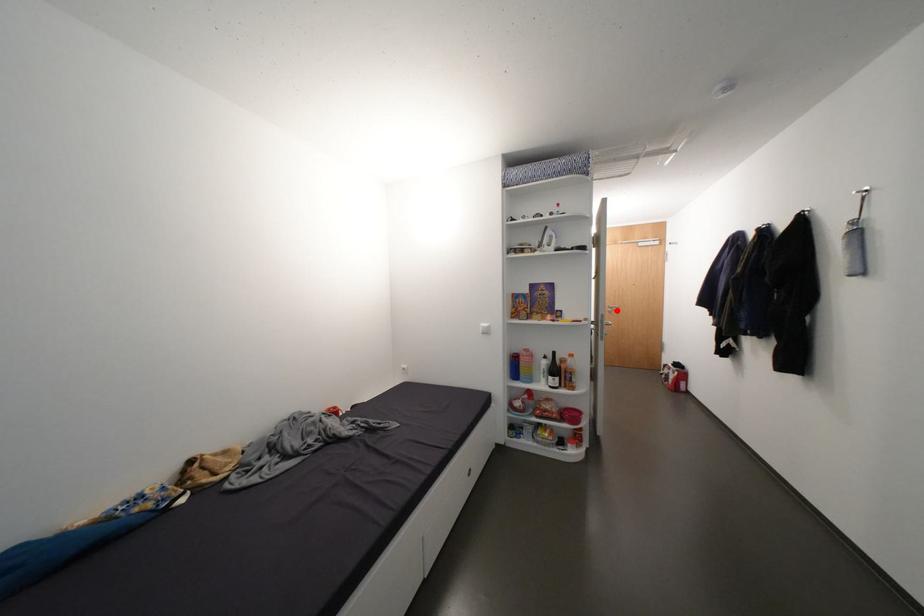
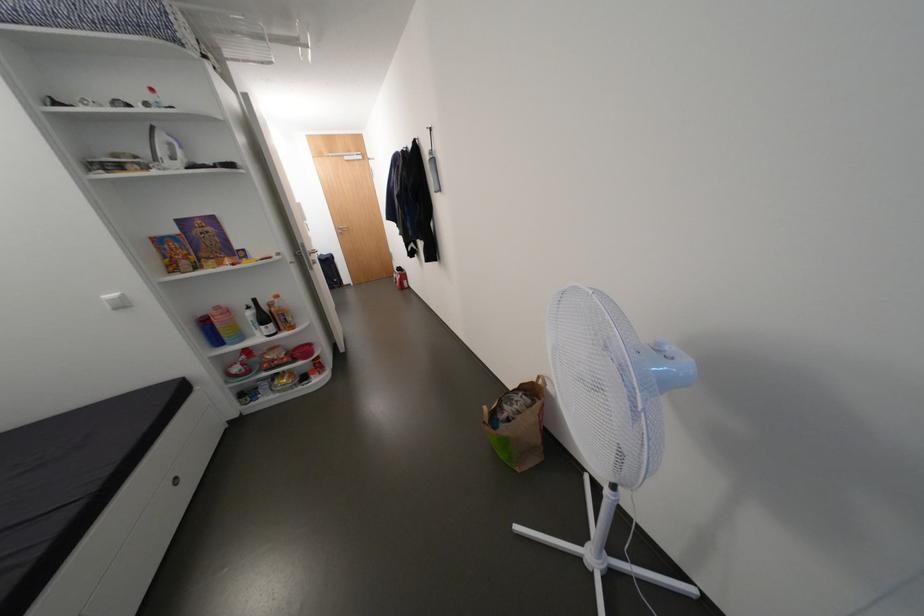
Find the pixel in the second image that matches the highlighted location in the first image.

(348, 233)